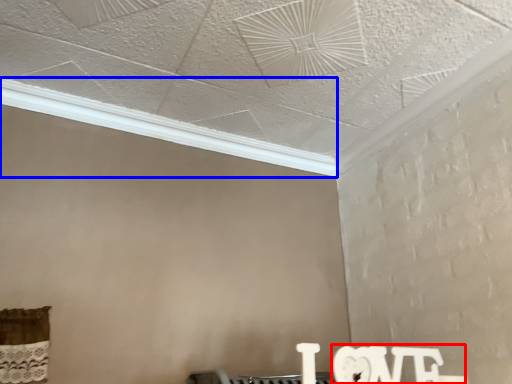
Question: Which point is further to the camera, writing (highlighted by a red box) or window (highlighted by a blue box)?

Choices:
 (A) writing
 (B) window

Answer: (B)